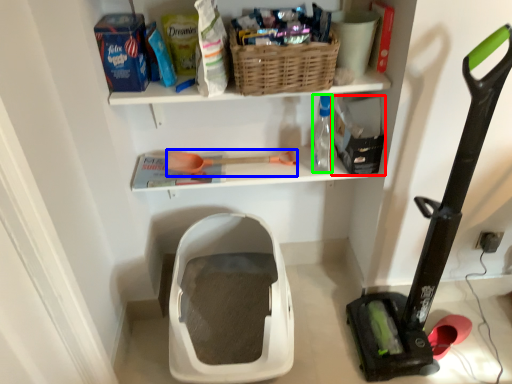
Question: Which object is positioned farthest from storage box (highlighted by a red box)? Select from tool (highlighted by a blue box) and bottle (highlighted by a green box).

Choices:
 (A) tool
 (B) bottle

Answer: (A)